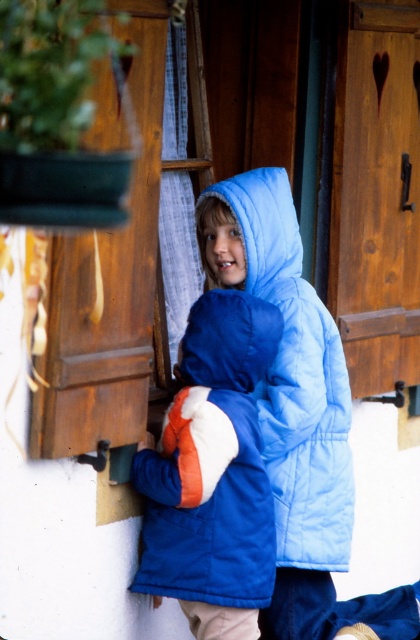
Consider the image. You are standing in front of the wooden door with a heart cutout and see two points marked in the image. Which point, point (254, 540) or point (268, 198), is closer to you?

Point (254, 540) is closer to the viewer than point (268, 198).